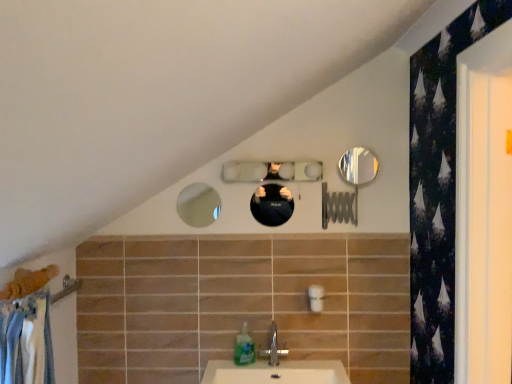
Question: Is matte glass mirror at upper center, the fourth mirror positioned from the right, situated inside clear glass mirror at center, arranged as the third mirror when viewed from the left, or outside?

Choices:
 (A) inside
 (B) outside

Answer: (B)

Question: Is matte glass mirror at upper center, the fourth mirror positioned from the right, taller or shorter than clear glass mirror at center, placed as the second mirror when sorted from right to left?

Choices:
 (A) short
 (B) tall

Answer: (B)

Question: Which is nearer to the shiny metallic mirror at upper right, which is the fourth mirror from left to right?

Choices:
 (A) silver metallic tap at center
 (B) translucent plastic soap dispenser at lower center
 (C) shiny black mirror at center, the second mirror from the left
 (D) clear glass mirror at center, placed as the second mirror when sorted from right to left
 (E) white ceramic sink at lower center

Answer: (D)

Question: Which object is positioned closest to the matte glass mirror at upper center, the fourth mirror positioned from the right?

Choices:
 (A) translucent plastic soap dispenser at lower center
 (B) shiny metallic mirror at upper right, which is the fourth mirror from left to right
 (C) shiny black mirror at center, arranged as the 3th mirror when viewed from the right
 (D) silver metallic tap at center
 (E) clear glass mirror at center, arranged as the third mirror when viewed from the left

Answer: (C)